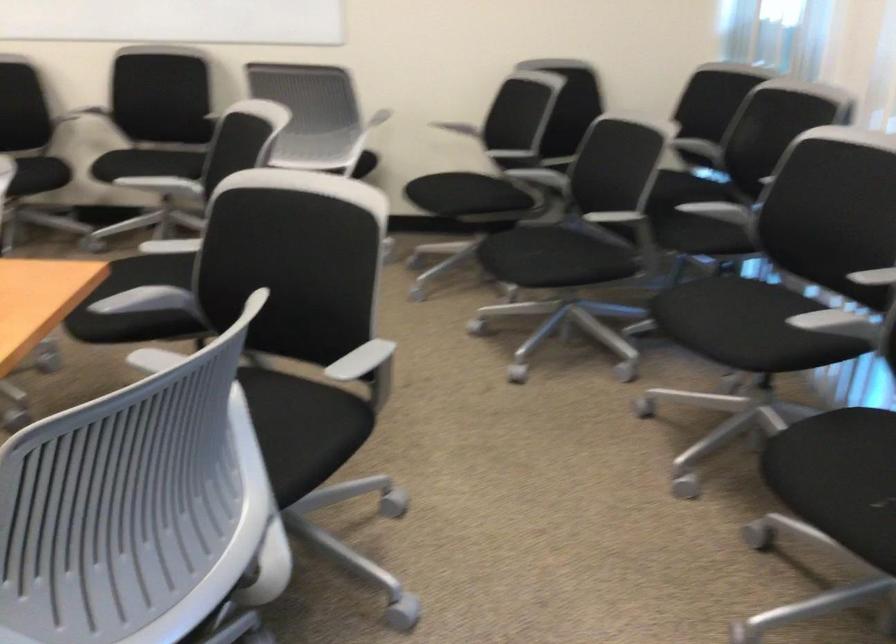
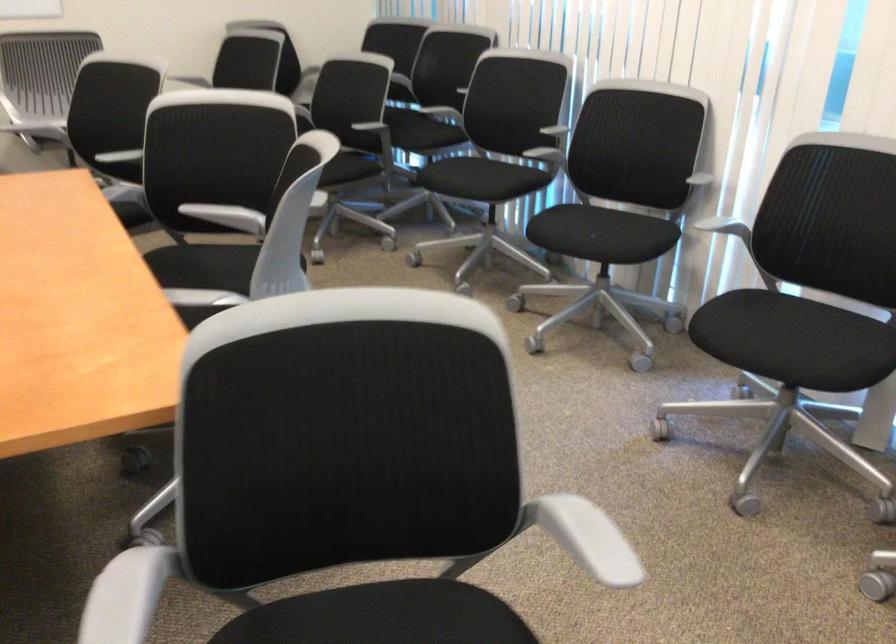
Find the pixel in the second image that matches (737,330) in the first image.

(480, 178)